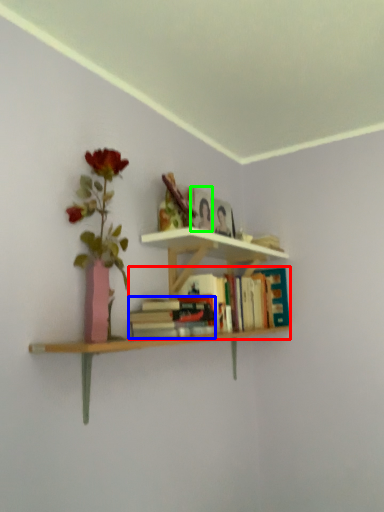
Question: Considering the real-world distances, which object is closest to book (highlighted by a red box)? book (highlighted by a blue box) or paperback book (highlighted by a green box).

Choices:
 (A) book
 (B) paperback book

Answer: (A)